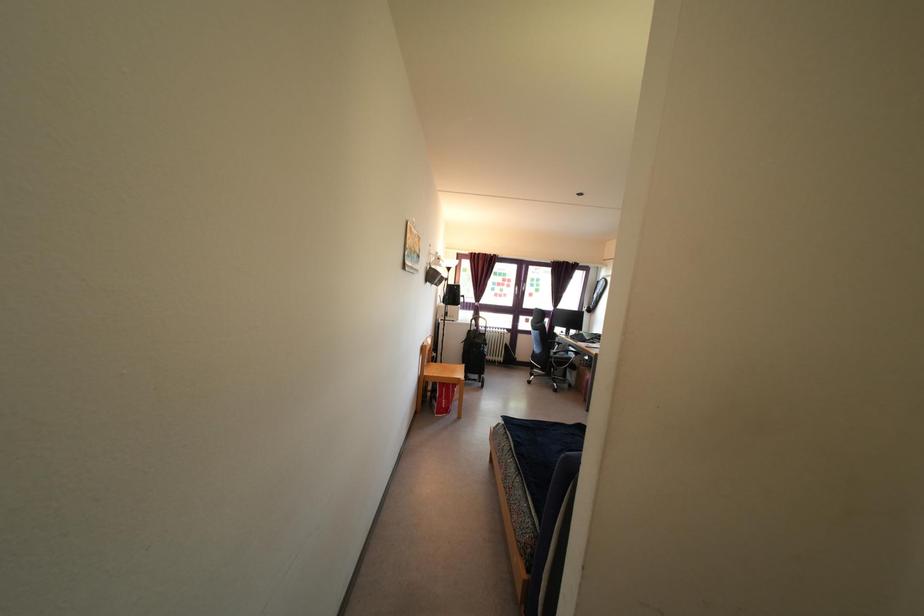
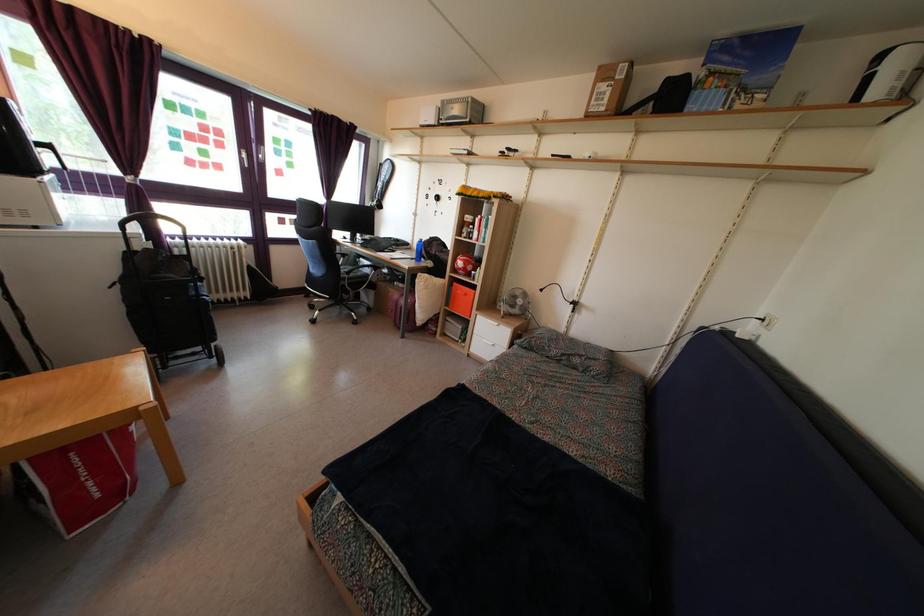
In the second image, find the point that corresponds to point 450,419 in the first image.

(122, 501)